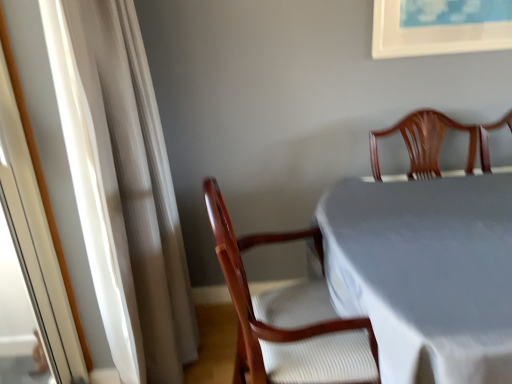
Question: Can you confirm if white sheer curtain at left is smaller than wooden chair at center?

Choices:
 (A) no
 (B) yes

Answer: (B)

Question: Is white sheer curtain at left to the left of wooden chair at center from the viewer's perspective?

Choices:
 (A) no
 (B) yes

Answer: (B)

Question: Does white sheer curtain at left turn towards wooden chair at center?

Choices:
 (A) no
 (B) yes

Answer: (B)

Question: Would you say white sheer curtain at left is a long distance from wooden chair at center?

Choices:
 (A) yes
 (B) no

Answer: (B)

Question: From a real-world perspective, is white sheer curtain at left over wooden chair at center?

Choices:
 (A) no
 (B) yes

Answer: (B)

Question: Is point (172, 374) closer or farther from the camera than point (444, 208)?

Choices:
 (A) closer
 (B) farther

Answer: (B)

Question: Considering their positions, is white sheer curtain at left located in front of or behind white cloth-covered table at center?

Choices:
 (A) behind
 (B) front

Answer: (A)

Question: Looking at the image, does white sheer curtain at left seem bigger or smaller compared to white cloth-covered table at center?

Choices:
 (A) small
 (B) big

Answer: (A)

Question: Is white sheer curtain at left wider or thinner than white cloth-covered table at center?

Choices:
 (A) thin
 (B) wide

Answer: (A)

Question: Based on their sizes in the image, would you say white cloth-covered table at center is bigger or smaller than wooden chair at center?

Choices:
 (A) small
 (B) big

Answer: (B)

Question: From the image's perspective, is white cloth-covered table at center positioned above or below wooden chair at center?

Choices:
 (A) above
 (B) below

Answer: (B)

Question: Is point (431, 183) positioned closer to the camera than point (291, 357)?

Choices:
 (A) closer
 (B) farther

Answer: (B)

Question: Is white cloth-covered table at center in front of or behind wooden chair at center in the image?

Choices:
 (A) behind
 (B) front

Answer: (B)

Question: From the image's perspective, is white cloth-covered table at center positioned above or below white sheer curtain at left?

Choices:
 (A) below
 (B) above

Answer: (A)

Question: Is white cloth-covered table at center inside the boundaries of white sheer curtain at left, or outside?

Choices:
 (A) inside
 (B) outside

Answer: (B)